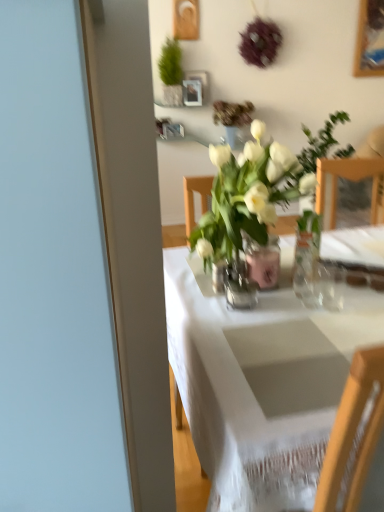
Question: From the image's perspective, is clear glass vase at center, acting as the first vase starting from the front, positioned above or below pink glass vase at center, which appears as the 1th vase when viewed from the back?

Choices:
 (A) below
 (B) above

Answer: (A)

Question: Based on their sizes in the image, would you say clear glass vase at center, acting as the first vase starting from the front, is bigger or smaller than pink glass vase at center, which appears as the 1th vase when viewed from the back?

Choices:
 (A) big
 (B) small

Answer: (B)

Question: Which object is the farthest from the white glass vase at center, which is counted as the first houseplant, starting from the right?

Choices:
 (A) white cloth table at center
 (B) pink glass vase at center, which appears as the 1th vase when viewed from the back
 (C) clear glass vase at center, the 2th vase viewed from the back
 (D) green matte plant at upper center, which is the 2th houseplant in right-to-left order

Answer: (D)

Question: Considering the real-world distances, which object is farthest from the green matte plant at upper center, which is the first houseplant from back to front?

Choices:
 (A) white glass vase at center, the 2th houseplant viewed from the back
 (B) pink glass vase at center, the second vase from the front
 (C) white cloth table at center
 (D) clear glass vase at center, acting as the first vase starting from the front

Answer: (C)